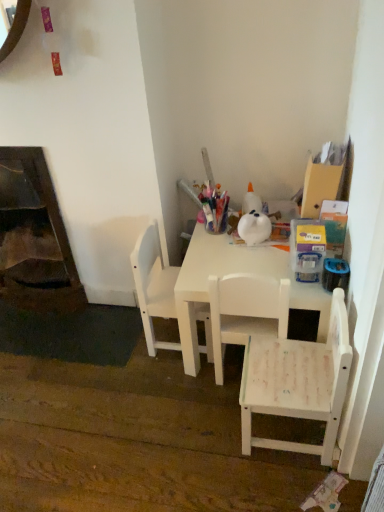
Question: Is white matte chair at center, acting as the second chair starting from the right, bigger or smaller than white matte table at center?

Choices:
 (A) small
 (B) big

Answer: (A)

Question: Is white matte chair at center, acting as the second chair starting from the right, spatially inside white matte table at center, or outside of it?

Choices:
 (A) outside
 (B) inside

Answer: (B)

Question: Which object is positioned farthest from the white matte table at center?

Choices:
 (A) dark brown wood fireplace at lower left
 (B) white matte chair at center, acting as the 3th chair starting from the right
 (C) white matte chair at lower right, the 1th chair viewed from the right
 (D) white matte chair at center, the 2th chair when ordered from left to right

Answer: (A)

Question: Considering the real-world distances, which object is farthest from the dark brown wood fireplace at lower left?

Choices:
 (A) white matte chair at center, positioned as the 1th chair in left-to-right order
 (B) white matte table at center
 (C) white matte chair at center, acting as the second chair starting from the right
 (D) white matte chair at lower right, marked as the third chair in a left-to-right arrangement

Answer: (D)